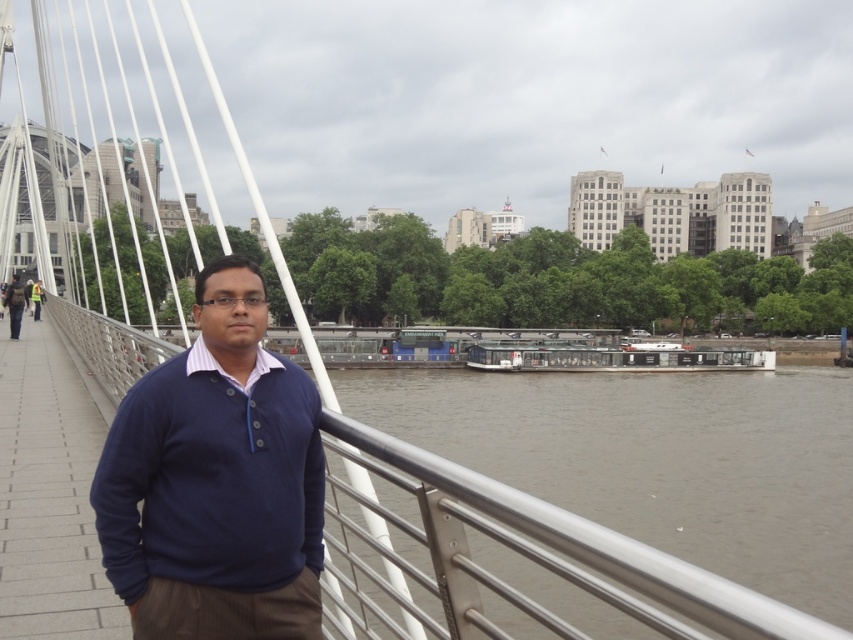
Question: Does navy blue sweater at center appear under matte blue sweater at center?

Choices:
 (A) no
 (B) yes

Answer: (B)

Question: Which object appears farthest from the camera in this image?

Choices:
 (A) navy blue sweater at center
 (B) matte black backpack at left
 (C) matte blue sweater at center
 (D) white glossy boat at center

Answer: (D)

Question: Does matte black backpack at left appear over matte blue sweater at center?

Choices:
 (A) yes
 (B) no

Answer: (A)

Question: Which object is positioned farthest from the matte blue sweater at center?

Choices:
 (A) white glossy boat at center
 (B) matte black backpack at left

Answer: (A)

Question: Does navy blue sweater at center lie behind matte blue sweater at center?

Choices:
 (A) yes
 (B) no

Answer: (B)

Question: Which point appears closest to the camera in this image?

Choices:
 (A) (15, 317)
 (B) (300, 412)

Answer: (B)